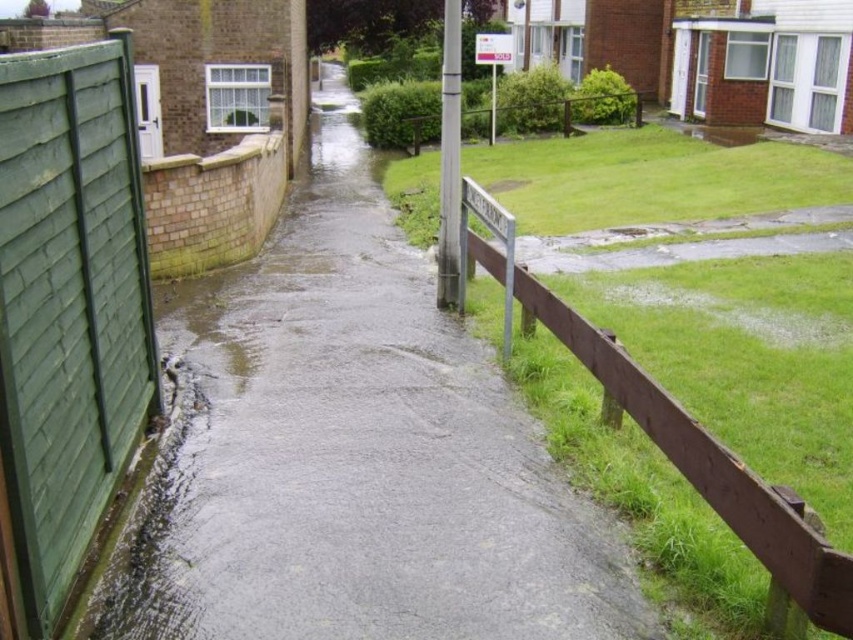
Question: Estimate the real-world distances between objects in this image. Which object is closer to the gray concrete flood at center?

Choices:
 (A) green wooden fence at left
 (B) white plastic sign at center
 (C) brown wooden fence at lower right
 (D) brown wooden fence at upper center

Answer: (A)

Question: Which point is farther to the camera?

Choices:
 (A) brown wooden fence at upper center
 (B) gray concrete flood at center

Answer: (A)

Question: Does gray concrete flood at center have a larger size compared to brown wooden fence at upper center?

Choices:
 (A) yes
 (B) no

Answer: (A)

Question: In this image, where is gray concrete flood at center located relative to brown wooden fence at lower right?

Choices:
 (A) above
 (B) below

Answer: (A)

Question: Which of the following is the farthest from the observer?

Choices:
 (A) (775, 529)
 (B) (436, 113)

Answer: (B)

Question: Does gray concrete flood at center come behind white plastic sign at center?

Choices:
 (A) yes
 (B) no

Answer: (B)